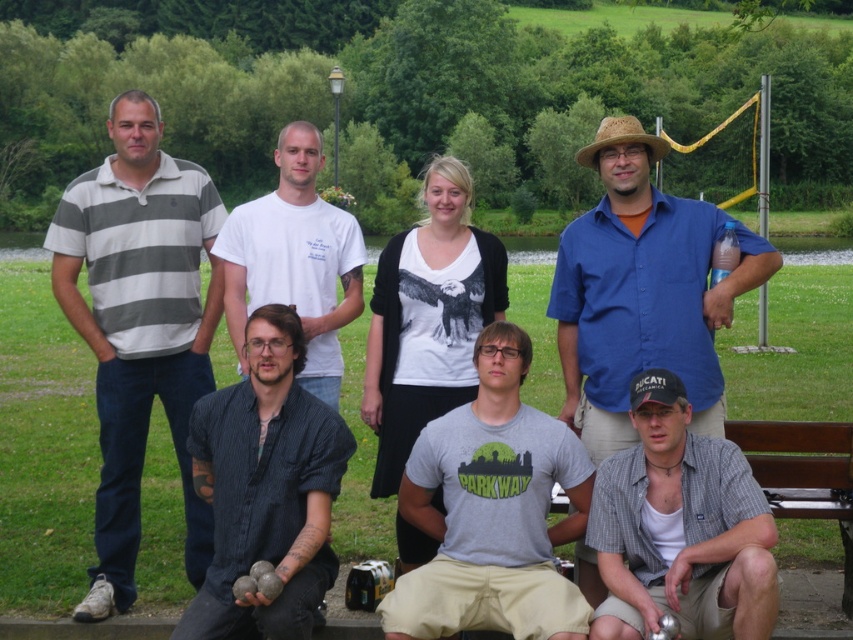
You are standing in the park and want to walk from point A to point B. Point A is located at coordinate point (x=573, y=401) and point B is at coordinate point (x=263, y=340). Since you can only move forward, which direction should you face to move from point A to point B without turning?

Since point A at (x=573, y=401) is closer to the viewer than point B at (x=263, y=340), you should face towards the direction away from the viewer to move from point A to point B without turning.